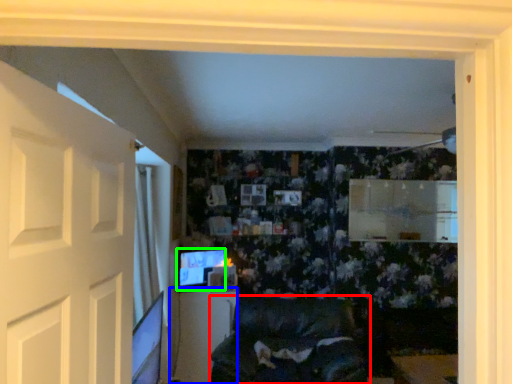
Question: Which object is positioned closest to furniture (highlighted by a red box)? Select from table (highlighted by a blue box) and computer monitor (highlighted by a green box).

Choices:
 (A) table
 (B) computer monitor

Answer: (A)